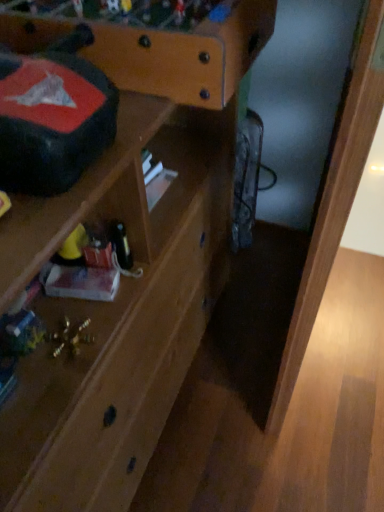
Question: From the image's perspective, is matte black writing desk at upper left on top of wooden shelf at center?

Choices:
 (A) no
 (B) yes

Answer: (B)

Question: Considering the relative sizes of matte black writing desk at upper left and wooden shelf at center in the image provided, is matte black writing desk at upper left bigger than wooden shelf at center?

Choices:
 (A) no
 (B) yes

Answer: (A)

Question: Is matte black writing desk at upper left surrounding wooden shelf at center?

Choices:
 (A) no
 (B) yes

Answer: (A)

Question: Is matte black writing desk at upper left positioned far away from wooden shelf at center?

Choices:
 (A) no
 (B) yes

Answer: (A)

Question: Is matte black writing desk at upper left at the left side of wooden shelf at center?

Choices:
 (A) yes
 (B) no

Answer: (B)

Question: Does point (69, 223) appear closer or farther from the camera than point (167, 77)?

Choices:
 (A) farther
 (B) closer

Answer: (B)

Question: Which is correct: wooden shelf at center is inside matte black writing desk at upper left, or outside of it?

Choices:
 (A) inside
 (B) outside

Answer: (B)

Question: Is wooden shelf at center wider or thinner than matte black writing desk at upper left?

Choices:
 (A) thin
 (B) wide

Answer: (A)

Question: From the image's perspective, relative to matte black writing desk at upper left, is wooden shelf at center above or below?

Choices:
 (A) above
 (B) below

Answer: (B)

Question: From a real-world perspective, is light brown wood at lower right physically located above or below matte black writing desk at upper left?

Choices:
 (A) below
 (B) above

Answer: (A)

Question: Considering their positions, is light brown wood at lower right located in front of or behind matte black writing desk at upper left?

Choices:
 (A) behind
 (B) front

Answer: (B)

Question: Is light brown wood at lower right bigger or smaller than matte black writing desk at upper left?

Choices:
 (A) small
 (B) big

Answer: (B)

Question: In terms of height, does light brown wood at lower right look taller or shorter compared to matte black writing desk at upper left?

Choices:
 (A) short
 (B) tall

Answer: (B)

Question: Would you say light brown wood at lower right is inside or outside wooden shelf at center?

Choices:
 (A) outside
 (B) inside

Answer: (A)

Question: Based on their positions, is light brown wood at lower right located to the left or right of wooden shelf at center?

Choices:
 (A) left
 (B) right

Answer: (B)